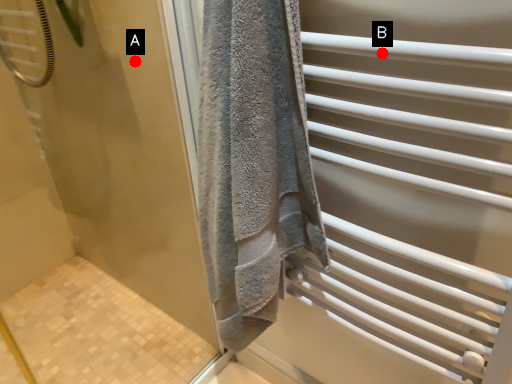
Question: Two points are circled on the image, labeled by A and B beside each circle. Which point is closer to the camera?

Choices:
 (A) A is closer
 (B) B is closer

Answer: (B)